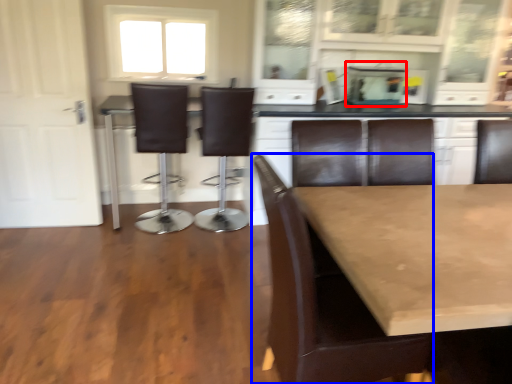
Question: Which object is closer to the camera taking this photo, appliance (highlighted by a red box) or chair (highlighted by a blue box)?

Choices:
 (A) appliance
 (B) chair

Answer: (B)